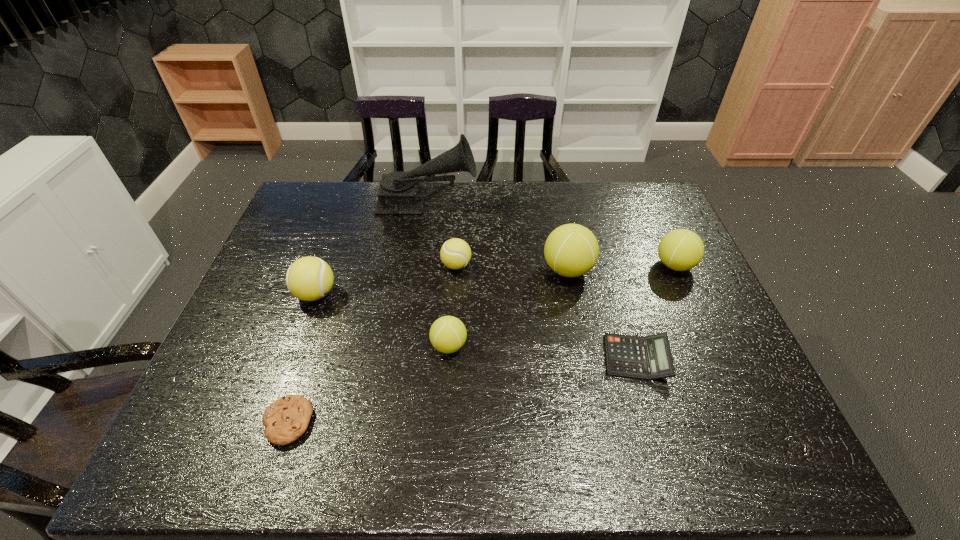
This screenshot has height=540, width=960. In order to click on free location that satisfies the following two spatial constraints: 1. from the horn of the rightmost tennis ball; 2. on the left side of the black phonograph_record in this screenshot , I will do `click(418, 265)`.